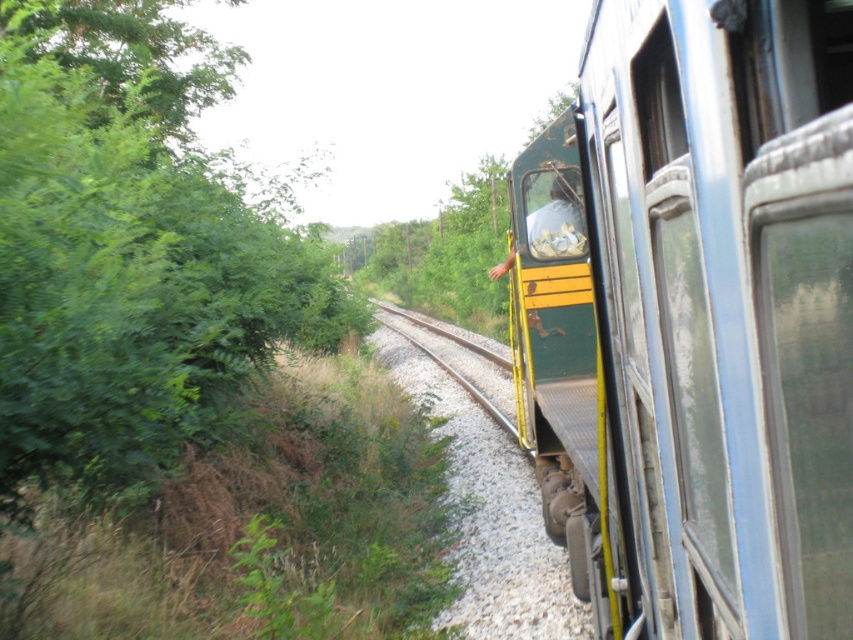
You are standing at the center of the train looking out the window. Which direction should you turn to see the green leafy tree at left?

You should turn to your left to see the green leafy tree at left since it is located at the left side of the scene.

You are standing on the train platform and looking at the train through the window. There is a point marked at coordinates [718,316]. What object is located at that point?

The point at coordinates [718,316] indicates the green matte train at center.